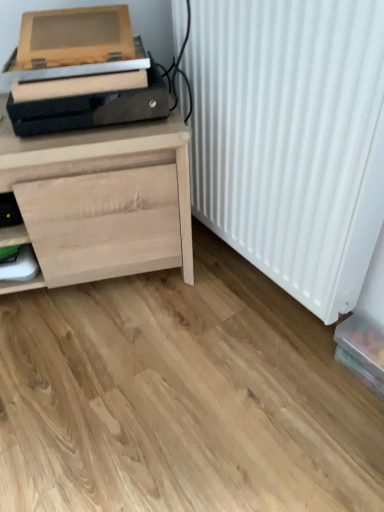
The height and width of the screenshot is (512, 384). Describe the element at coordinates (362, 351) in the screenshot. I see `translucent plastic box at lower right` at that location.

What do you see at coordinates (96, 5) in the screenshot? This screenshot has height=512, width=384. I see `wooden printer at upper left` at bounding box center [96, 5].

This screenshot has height=512, width=384. What do you see at coordinates (102, 199) in the screenshot?
I see `natural wood chest of drawers at left` at bounding box center [102, 199].

Where is `translucent plastic box at lower right`? Image resolution: width=384 pixels, height=512 pixels. translucent plastic box at lower right is located at coordinates (362, 351).

Is point (341, 344) closer to viewer compared to point (193, 70)?

That is False.

Who is smaller, translucent plastic box at lower right or white matte radiator at right?

translucent plastic box at lower right is smaller.

Who is shorter, translucent plastic box at lower right or natural wood chest of drawers at left?

translucent plastic box at lower right.

Does translucent plastic box at lower right have a larger size compared to natural wood chest of drawers at left?

Actually, translucent plastic box at lower right might be smaller than natural wood chest of drawers at left.

From the image's perspective, which one is positioned higher, translucent plastic box at lower right or natural wood chest of drawers at left?

natural wood chest of drawers at left, from the image's perspective.

What's the angular difference between translucent plastic box at lower right and natural wood chest of drawers at left's facing directions?

They differ by 67.9 degrees in their facing directions.

Is the surface of natural wood chest of drawers at left in direct contact with translucent plastic box at lower right?

There is a gap between natural wood chest of drawers at left and translucent plastic box at lower right.

Is natural wood chest of drawers at left facing away from translucent plastic box at lower right?

natural wood chest of drawers at left does not have its back to translucent plastic box at lower right.

What's the angular difference between natural wood chest of drawers at left and translucent plastic box at lower right's facing directions?

They differ by 67.9 degrees in their facing directions.

Consider the image. Who is taller, natural wood chest of drawers at left or translucent plastic box at lower right?

natural wood chest of drawers at left is taller.

Consider the image. Considering the positions of objects wooden printer at upper left and white matte radiator at right in the image provided, who is behind, wooden printer at upper left or white matte radiator at right?

Positioned behind is wooden printer at upper left.

Is there a large distance between wooden printer at upper left and white matte radiator at right?

Actually, wooden printer at upper left and white matte radiator at right are a little close together.

In the scene shown: Would you say wooden printer at upper left is outside white matte radiator at right?

Yes, wooden printer at upper left is located beyond the bounds of white matte radiator at right.

Which is nearer, (x=320, y=240) or (x=105, y=132)?

Point (x=320, y=240) appears to be closer to the viewer than point (x=105, y=132).

Does white matte radiator at right lie in front of natural wood chest of drawers at left?

Yes.

Can you confirm if white matte radiator at right is shorter than natural wood chest of drawers at left?

In fact, white matte radiator at right may be taller than natural wood chest of drawers at left.

From a real-world perspective, which object stands above the other?

In real-world perspective, white matte radiator at right is above.

Is natural wood chest of drawers at left facing towards white matte radiator at right?

No, natural wood chest of drawers at left does not turn towards white matte radiator at right.

Is natural wood chest of drawers at left situated inside white matte radiator at right or outside?

natural wood chest of drawers at left is not enclosed by white matte radiator at right.

Is point (65, 188) positioned in front of point (347, 2)?

No, (65, 188) is further to viewer.

Is the depth of natural wood chest of drawers at left greater than that of white matte radiator at right?

Yes, natural wood chest of drawers at left is further from the camera.

In the image, there is a wooden printer at upper left. Identify the location of the chest of drawers below it (from the image's perspective). pyautogui.click(x=102, y=199).

From a real-world perspective, is natural wood chest of drawers at left below wooden printer at upper left?

Yes, from a real-world perspective, natural wood chest of drawers at left is beneath wooden printer at upper left.

Is there a large distance between natural wood chest of drawers at left and wooden printer at upper left?

No, natural wood chest of drawers at left is not far from wooden printer at upper left.

Does point (74, 146) come farther from viewer compared to point (132, 25)?

No, (74, 146) is closer to viewer.

I want to click on radiator that appears above the translucent plastic box at lower right (from a real-world perspective), so click(291, 139).

At what (x,y) coordinates should I click in order to perform the action: click on the chest of drawers above the translucent plastic box at lower right (from the image's perspective). Please return your answer as a coordinate pair (x, y). This screenshot has height=512, width=384. Looking at the image, I should click on (102, 199).

From the image, which object appears to be farther from wooden printer at upper left, translucent plastic box at lower right or natural wood chest of drawers at left?

translucent plastic box at lower right is further to wooden printer at upper left.

Looking at the image, which one is located further to natural wood chest of drawers at left, wooden printer at upper left or translucent plastic box at lower right?

translucent plastic box at lower right is further to natural wood chest of drawers at left.

When comparing their distances from white matte radiator at right, does translucent plastic box at lower right or natural wood chest of drawers at left seem further?

translucent plastic box at lower right.

Which object lies further to the anchor point translucent plastic box at lower right, natural wood chest of drawers at left or white matte radiator at right?

Among the two, natural wood chest of drawers at left is located further to translucent plastic box at lower right.

From the image, which object appears to be farther from translucent plastic box at lower right, wooden printer at upper left or white matte radiator at right?

wooden printer at upper left is positioned further to the anchor translucent plastic box at lower right.

Considering their positions, is translucent plastic box at lower right positioned further to natural wood chest of drawers at left than white matte radiator at right?

The object further to natural wood chest of drawers at left is translucent plastic box at lower right.

When comparing their distances from white matte radiator at right, does natural wood chest of drawers at left or translucent plastic box at lower right seem closer?

natural wood chest of drawers at left is positioned closer to the anchor white matte radiator at right.

From the image, which object appears to be nearer to wooden printer at upper left, translucent plastic box at lower right or white matte radiator at right?

The object closer to wooden printer at upper left is white matte radiator at right.

At what (x,y) coordinates should I click in order to perform the action: click on radiator between natural wood chest of drawers at left and translucent plastic box at lower right from left to right. Please return your answer as a coordinate pair (x, y). Looking at the image, I should click on (291, 139).

Identify the location of printer situated between natural wood chest of drawers at left and translucent plastic box at lower right from left to right. This screenshot has height=512, width=384. (96, 5).

The image size is (384, 512). Identify the location of radiator that lies between wooden printer at upper left and translucent plastic box at lower right from top to bottom. (291, 139).

This screenshot has width=384, height=512. Identify the location of printer situated between natural wood chest of drawers at left and white matte radiator at right from left to right. (96, 5).